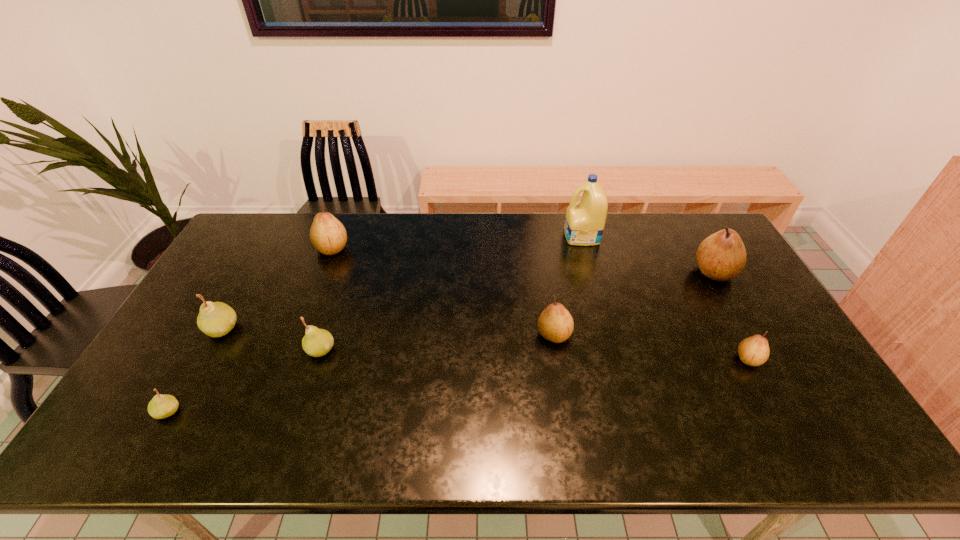
In order to click on free space between the smallest brown pear and the fourth object from right to left in this screenshot , I will do `click(651, 347)`.

The height and width of the screenshot is (540, 960). In order to click on free space between the leftmost brown pear and the biggest brown pear in this screenshot , I will do `click(523, 260)`.

Point out which object is positioned as the nearest to the rightmost green pear. Please provide its 2D coordinates. Your answer should be formatted as a tuple, i.e. [(x, y)], where the tuple contains the x and y coordinates of a point satisfying the conditions above.

[(216, 319)]

This screenshot has height=540, width=960. I want to click on object that is the second closest to the biggest green pear, so click(317, 342).

Identify the location of the fifth closest pear to the biggest green pear. Image resolution: width=960 pixels, height=540 pixels. point(754,351).

Choose which pear is the nearest neighbor to the seventh shortest object. Please provide its 2D coordinates. Your answer should be formatted as a tuple, i.e. [(x, y)], where the tuple contains the x and y coordinates of a point satisfying the conditions above.

[(754, 351)]

Identify the location of brown pear identified as the fourth closest to the second smallest green pear. (722, 256).

What are the coordinates of `the third closest brown pear to the second biggest green pear` in the screenshot? It's located at (754, 351).

Locate an element on the screen. This screenshot has height=540, width=960. green pear that is the closest one to the third smallest brown pear is located at coordinates (216, 319).

Identify which green pear is the third closest to the third biggest brown pear. Please provide its 2D coordinates. Your answer should be formatted as a tuple, i.e. [(x, y)], where the tuple contains the x and y coordinates of a point satisfying the conditions above.

[(161, 406)]